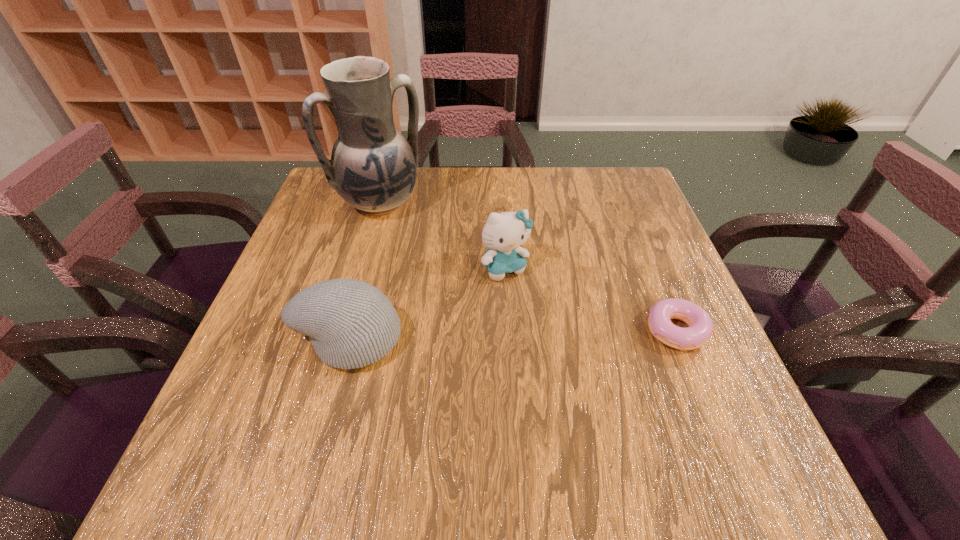
Where is `the third tallest object`? the third tallest object is located at coordinates (351, 324).

Identify the location of doughnut. (700, 328).

In order to click on the rightmost object in this screenshot , I will do `click(700, 328)`.

Where is `pitcher`? This screenshot has height=540, width=960. pitcher is located at coordinates (373, 167).

The height and width of the screenshot is (540, 960). Identify the location of the farthest object. (373, 167).

This screenshot has height=540, width=960. I want to click on the second farthest object, so click(x=503, y=233).

The image size is (960, 540). I want to click on kitten, so click(503, 233).

Locate an element on the screen. vacant area situated on the right of the third tallest object is located at coordinates (427, 338).

Find the location of `vacant space located on the back of the doughnut`. vacant space located on the back of the doughnut is located at coordinates (637, 237).

The image size is (960, 540). What are the coordinates of `vacant space positioned 0.160m on the front-facing side of the pitcher` in the screenshot? It's located at (426, 259).